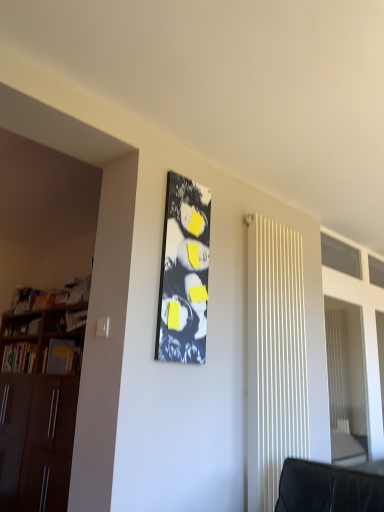
Question: Would you say white ribbed radiator at right is outside wooden at left?

Choices:
 (A) yes
 (B) no

Answer: (A)

Question: From a real-world perspective, is white ribbed radiator at right located beneath wooden at left?

Choices:
 (A) no
 (B) yes

Answer: (B)

Question: Is white ribbed radiator at right positioned far away from wooden at left?

Choices:
 (A) no
 (B) yes

Answer: (B)

Question: From the image's perspective, is white ribbed radiator at right on wooden at left?

Choices:
 (A) no
 (B) yes

Answer: (B)

Question: Is white ribbed radiator at right to the right of wooden at left from the viewer's perspective?

Choices:
 (A) yes
 (B) no

Answer: (A)

Question: From a real-world perspective, is white ribbed radiator at right positioned over wooden at left based on gravity?

Choices:
 (A) no
 (B) yes

Answer: (A)

Question: Can you confirm if hardcover book at left is bigger than matte black bulletin board at center?

Choices:
 (A) yes
 (B) no

Answer: (A)

Question: Does hardcover book at left have a lesser height compared to matte black bulletin board at center?

Choices:
 (A) yes
 (B) no

Answer: (A)

Question: Considering the relative positions of hardcover book at left and matte black bulletin board at center in the image provided, is hardcover book at left to the left of matte black bulletin board at center from the viewer's perspective?

Choices:
 (A) yes
 (B) no

Answer: (A)

Question: Does hardcover book at left have a lesser width compared to matte black bulletin board at center?

Choices:
 (A) no
 (B) yes

Answer: (A)

Question: Is hardcover book at left aimed at matte black bulletin board at center?

Choices:
 (A) no
 (B) yes

Answer: (A)

Question: From a real-world perspective, is hardcover book at left below matte black bulletin board at center?

Choices:
 (A) no
 (B) yes

Answer: (B)

Question: Would you say matte black bulletin board at center is a long distance from wooden at left?

Choices:
 (A) yes
 (B) no

Answer: (A)